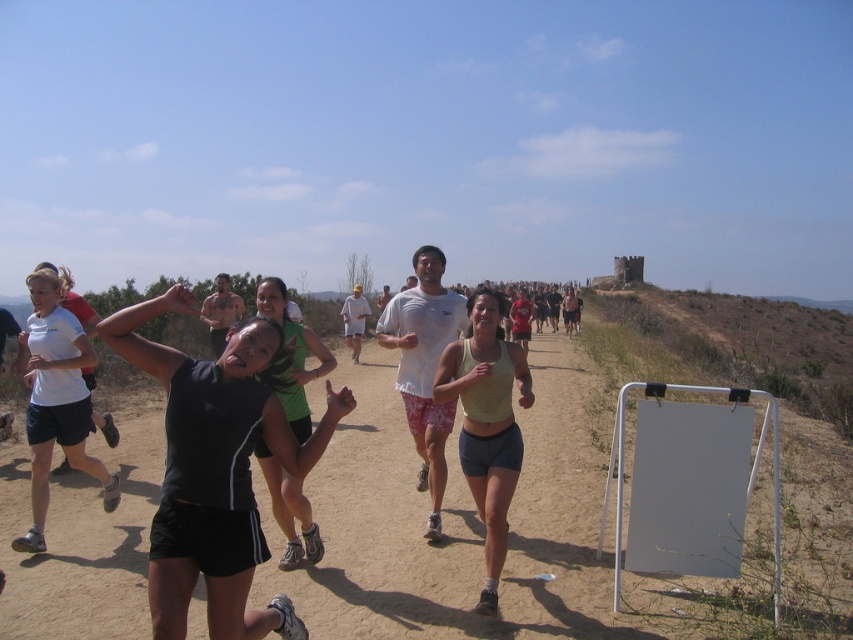
You are a photographer trying to capture a runner wearing a white matte tank top at center and black athletic shorts at center. If your camera has a maximum focus range of 2 meters, can you focus on both items at the same time?

The white matte tank top at center and black athletic shorts at center are 2.08 meters apart. Since the distance between them exceeds the camera maximum focus range of 2 meters, you cannot focus on both items at the same time.

You are a photographer positioned at the origin of the coordinate system. You want to capture a photo of the black fabric tank top at center. What are the coordinates where you should aim your camera?

The black fabric tank top at center is located at point [216,470], so you should aim your camera at those coordinates to capture it.

You are a runner in the trail race and you see two checkpoints marked by points on the path. The first checkpoint is at point (462, 403) and the second is at point (280, 317). Which checkpoint should you reach first if you are moving forward along the path?

You should reach the point (462, 403) first because it is in front of point (280, 317) along the path.